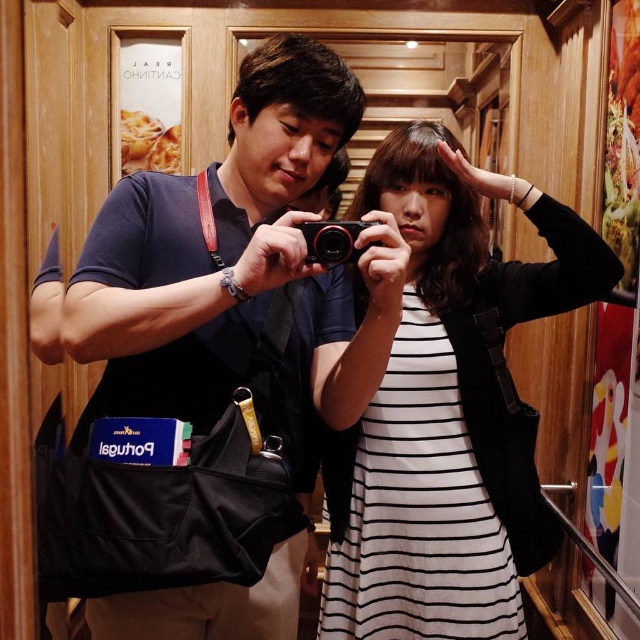
Does white striped dress at center appear on the left side of black plastic camera at center?

In fact, white striped dress at center is to the right of black plastic camera at center.

Who is lower down, white striped dress at center or black plastic camera at center?

Positioned lower is white striped dress at center.

Identify the location of white striped dress at center. This screenshot has height=640, width=640. (449, 410).

Between point (115, 554) and point (328, 248), which one is positioned behind?

Positioned behind is point (328, 248).

Does dark blue fabric shirt at center have a greater height compared to black plastic camera at center?

Yes, dark blue fabric shirt at center is taller than black plastic camera at center.

Is point (192, 353) farther from viewer compared to point (355, 252)?

Yes, it is.

Identify the location of dark blue fabric shirt at center. (212, 371).

Which is in front, point (269, 628) or point (326, 611)?

Point (269, 628) is in front.

Is point (198, 477) more distant than point (401, 598)?

No, (198, 477) is in front of (401, 598).

Where is `dark blue fabric shirt at center`? Image resolution: width=640 pixels, height=640 pixels. dark blue fabric shirt at center is located at coordinates (212, 371).

Identify the location of dark blue fabric shirt at center. This screenshot has height=640, width=640. (212, 371).